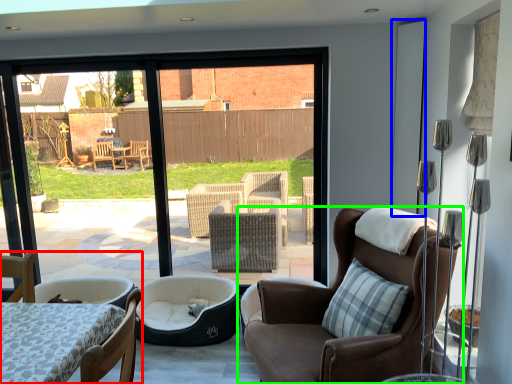
Question: Which object is positioned farthest from chair (highlighted by a red box)? Select from screen door (highlighted by a blue box) and chair (highlighted by a green box).

Choices:
 (A) screen door
 (B) chair

Answer: (A)